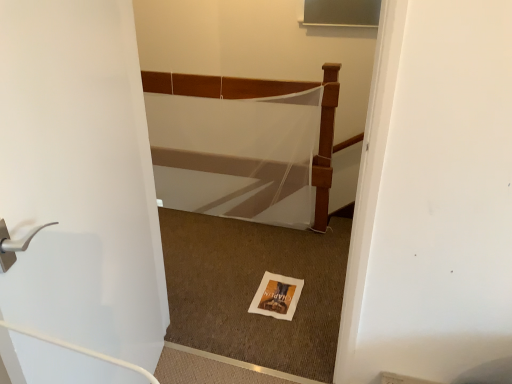
Question: In the image, is white matte door at left positioned in front of or behind white mesh bed at center?

Choices:
 (A) front
 (B) behind

Answer: (A)

Question: Considering the relative positions of white matte door at left and white mesh bed at center in the image provided, is white matte door at left to the left or to the right of white mesh bed at center?

Choices:
 (A) right
 (B) left

Answer: (B)

Question: Considering the real-world distances, which object is farthest from the white paper postcard at center?

Choices:
 (A) white matte door at left
 (B) white mesh bed at center

Answer: (A)

Question: Which object is positioned closest to the white paper postcard at center?

Choices:
 (A) white mesh bed at center
 (B) white matte door at left

Answer: (A)